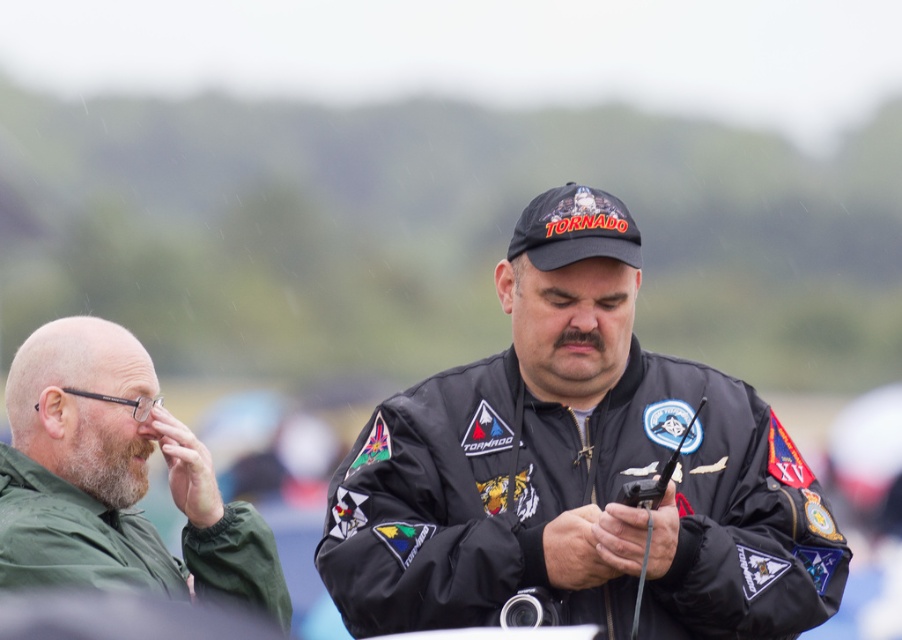
Based on the scene description, where is the black matte jacket at center located in terms of coordinates?

The black matte jacket at center is located at coordinates point (577, 468).

You are a photographer trying to capture a group photo of the two people in the scene. You want to arrange them so that the black matte jacket at center and the green matte jacket at left are both visible in the frame. Based on their current positions, which jacket is closer to the right edge of the photo?

The black matte jacket at center is positioned on the right side of the green matte jacket at left, meaning it is closer to the right edge of the photo.